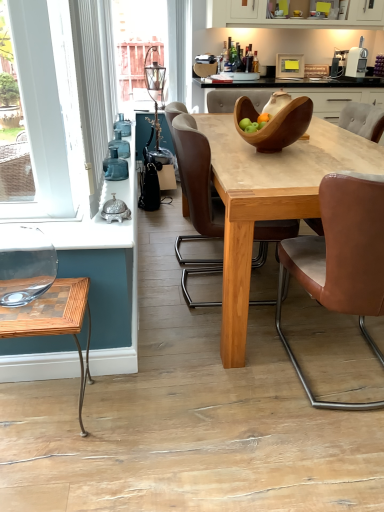
Question: From the image's perspective, is natural wood table at center on top of wooden checkered coffee table at lower left?

Choices:
 (A) no
 (B) yes

Answer: (B)

Question: Would you say wooden checkered coffee table at lower left is part of natural wood table at center's contents?

Choices:
 (A) yes
 (B) no

Answer: (B)

Question: Would you consider natural wood table at center to be distant from wooden checkered coffee table at lower left?

Choices:
 (A) yes
 (B) no

Answer: (B)

Question: Does natural wood table at center have a lesser height compared to wooden checkered coffee table at lower left?

Choices:
 (A) no
 (B) yes

Answer: (A)

Question: Is natural wood table at center bigger than wooden checkered coffee table at lower left?

Choices:
 (A) no
 (B) yes

Answer: (B)

Question: Is wooden bowl at center spatially inside brown leather chair at right, placed as the 3th chair when sorted from left to right, or outside of it?

Choices:
 (A) outside
 (B) inside

Answer: (A)

Question: Looking at their shapes, would you say wooden bowl at center is wider or thinner than brown leather chair at right, acting as the first chair starting from the right?

Choices:
 (A) wide
 (B) thin

Answer: (A)

Question: From a real-world perspective, relative to brown leather chair at right, acting as the first chair starting from the right, is wooden bowl at center vertically above or below?

Choices:
 (A) above
 (B) below

Answer: (A)

Question: From the image's perspective, is wooden bowl at center positioned above or below brown leather chair at right, placed as the 3th chair when sorted from left to right?

Choices:
 (A) above
 (B) below

Answer: (A)

Question: Based on their positions, is wooden bowl at center located to the left or right of brown leather chair at center, placed as the 1th chair when sorted from left to right?

Choices:
 (A) left
 (B) right

Answer: (B)

Question: Does point (334, 95) appear closer or farther from the camera than point (193, 304)?

Choices:
 (A) farther
 (B) closer

Answer: (A)

Question: Considering the positions of wooden bowl at center and brown leather chair at center, which ranks as the 3th chair in right-to-left order, in the image, is wooden bowl at center bigger or smaller than brown leather chair at center, which ranks as the 3th chair in right-to-left order,?

Choices:
 (A) small
 (B) big

Answer: (B)

Question: Considering the positions of wooden bowl at center and brown leather chair at center, placed as the 1th chair when sorted from left to right, in the image, is wooden bowl at center wider or thinner than brown leather chair at center, placed as the 1th chair when sorted from left to right,?

Choices:
 (A) wide
 (B) thin

Answer: (A)

Question: From a real-world perspective, is white matte cabinet at upper center physically located above or below brown leather chair at right, acting as the first chair starting from the right?

Choices:
 (A) below
 (B) above

Answer: (B)

Question: Would you say white matte cabinet at upper center is inside or outside brown leather chair at right, acting as the first chair starting from the right?

Choices:
 (A) inside
 (B) outside

Answer: (B)